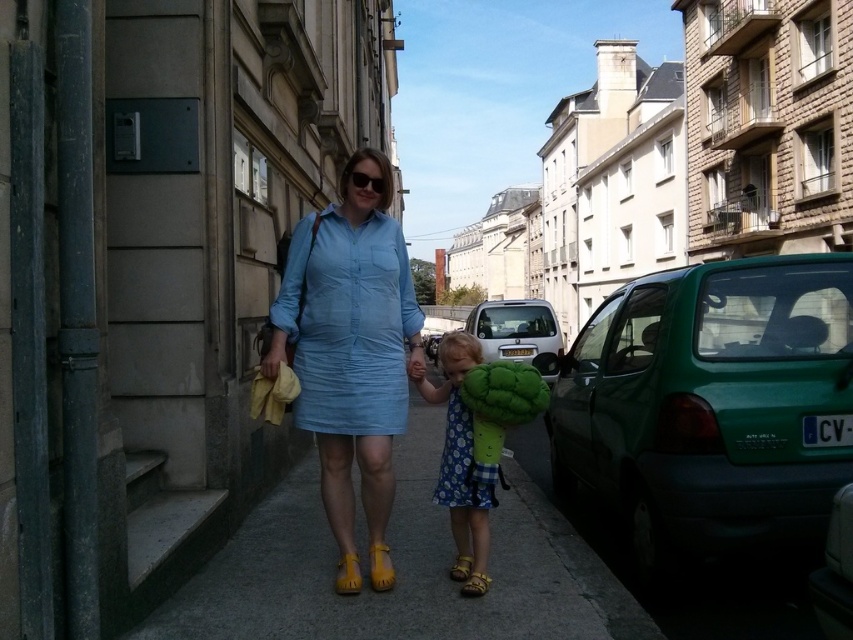
You are a pedestrian standing at the crosswalk and see the green matte car at right and the matte blue dress at center. Which object is closer to you?

The green matte car at right is closer to you because it is further to the viewer than the matte blue dress at center.

You are a photographer standing in the street scene. You want to take a photo of the matte blue dress at center and light blue cotton dress at center. The camera you are using has a maximum focus range of 2.5 inches. Can you capture both dresses in focus without moving the camera?

The distance between the matte blue dress at center and the light blue cotton dress at center is 2.55 inches. Since the camera can only focus within 2.5 inches, the dresses are slightly too far apart to be captured in focus simultaneously.